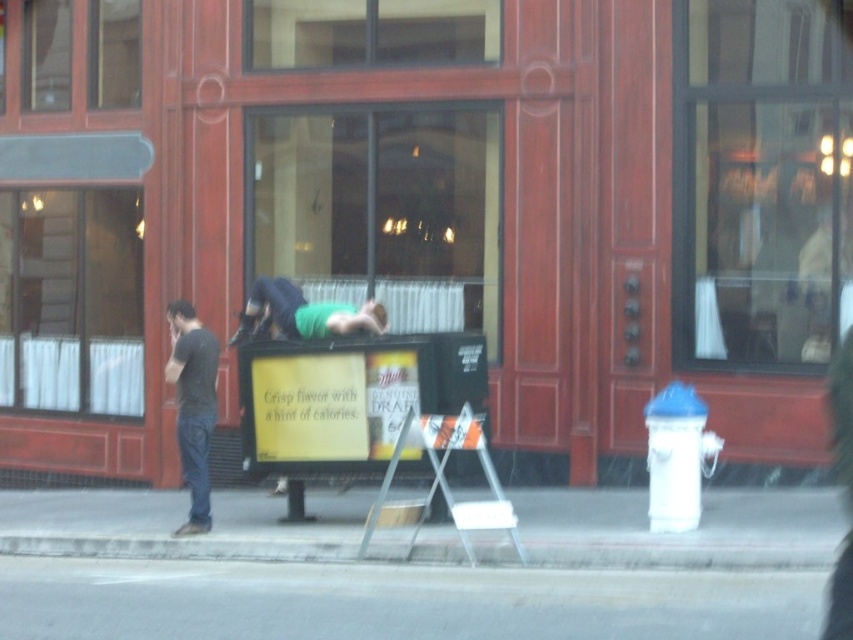
Question: Estimate the real-world distances between objects in this image. Which object is farther from the gray asphalt at lower center?

Choices:
 (A) gray concrete curb at lower center
 (B) green matte shirt at center
 (C) black cotton shirt at left

Answer: (A)

Question: Which of the following is the farthest from the observer?

Choices:
 (A) gray concrete curb at lower center
 (B) green matte shirt at center

Answer: (B)

Question: Which point is farther to the camera?

Choices:
 (A) (461, 557)
 (B) (201, 593)

Answer: (A)

Question: Is gray asphalt at lower center bigger than black cotton shirt at left?

Choices:
 (A) no
 (B) yes

Answer: (A)

Question: Can you confirm if gray asphalt at lower center is positioned below gray concrete curb at lower center?

Choices:
 (A) no
 (B) yes

Answer: (B)

Question: Can you confirm if gray concrete curb at lower center is wider than green matte shirt at center?

Choices:
 (A) no
 (B) yes

Answer: (A)